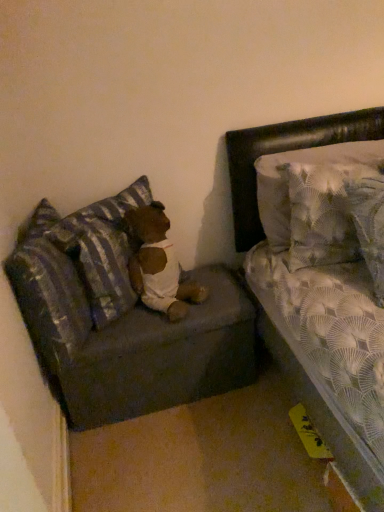
Where is `empty space that is to the right of brown plush teddy bear at center`? Image resolution: width=384 pixels, height=512 pixels. empty space that is to the right of brown plush teddy bear at center is located at coordinates (219, 295).